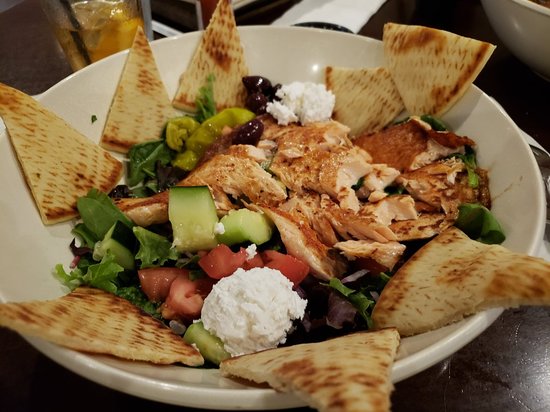
Identify the location of ceramic bowl. Image resolution: width=550 pixels, height=412 pixels. (27, 221).